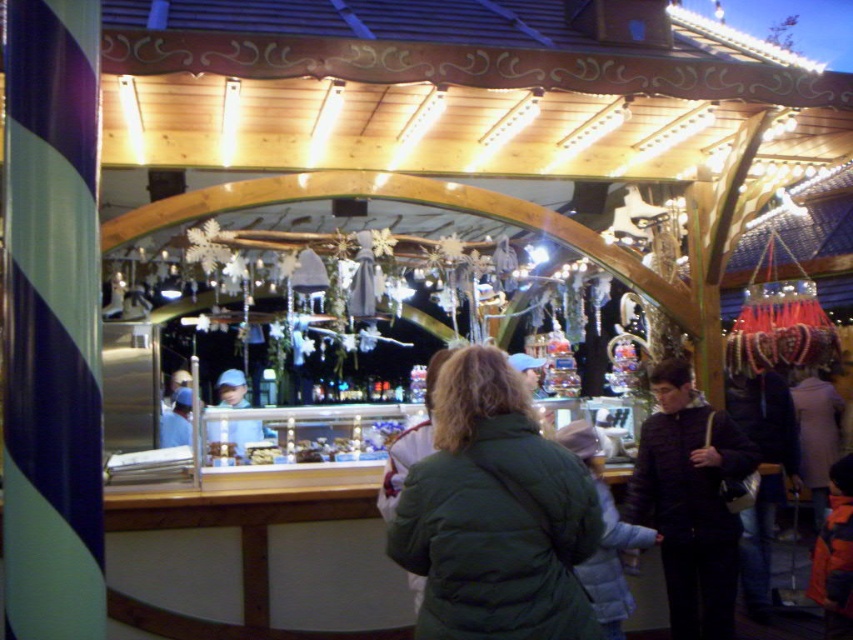
Question: Can you confirm if green quilted jacket at center is wider than dark green quilted jacket at center?

Choices:
 (A) yes
 (B) no

Answer: (A)

Question: Which of the following is the closest to the observer?

Choices:
 (A) dark green quilted jacket at center
 (B) green quilted jacket at center

Answer: (B)

Question: Can you confirm if green quilted jacket at center is positioned above dark green quilted jacket at center?

Choices:
 (A) yes
 (B) no

Answer: (A)

Question: Among these points, which one is nearest to the camera?

Choices:
 (A) (503, 509)
 (B) (677, 497)

Answer: (A)

Question: Can you confirm if green quilted jacket at center is positioned above dark green quilted jacket at center?

Choices:
 (A) yes
 (B) no

Answer: (A)